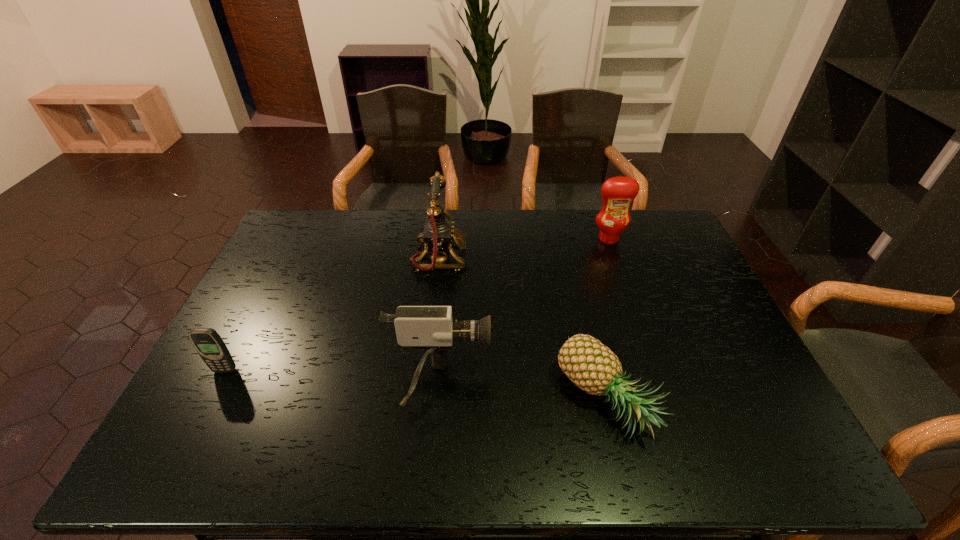
Where is `vacant region at the near right corner of the desktop`? Image resolution: width=960 pixels, height=540 pixels. vacant region at the near right corner of the desktop is located at coordinates (780, 456).

Image resolution: width=960 pixels, height=540 pixels. Identify the location of vacant area that lies between the condiment and the third shortest object. (524, 312).

Locate an element on the screen. The width and height of the screenshot is (960, 540). free area in between the camcorder and the condiment is located at coordinates (524, 312).

Where is `vacant area that lies between the pineapple and the camcorder`? This screenshot has height=540, width=960. vacant area that lies between the pineapple and the camcorder is located at coordinates (523, 392).

Locate an element on the screen. free spot between the third shortest object and the leftmost object is located at coordinates (332, 377).

Locate an element on the screen. The width and height of the screenshot is (960, 540). free space between the pineapple and the telephone is located at coordinates (523, 329).

What are the coordinates of `blank region between the cellular telephone and the telephone` in the screenshot? It's located at (332, 314).

The image size is (960, 540). I want to click on vacant region between the camcorder and the condiment, so click(x=524, y=312).

At what (x,y) coordinates should I click in order to perform the action: click on free space between the telephone and the pineapple. Please return your answer as a coordinate pair (x, y). Image resolution: width=960 pixels, height=540 pixels. Looking at the image, I should click on (523, 329).

At what (x,y) coordinates should I click in order to perform the action: click on vacant area that lies between the third shortest object and the leftmost object. Please return your answer as a coordinate pair (x, y). Looking at the image, I should click on (332, 377).